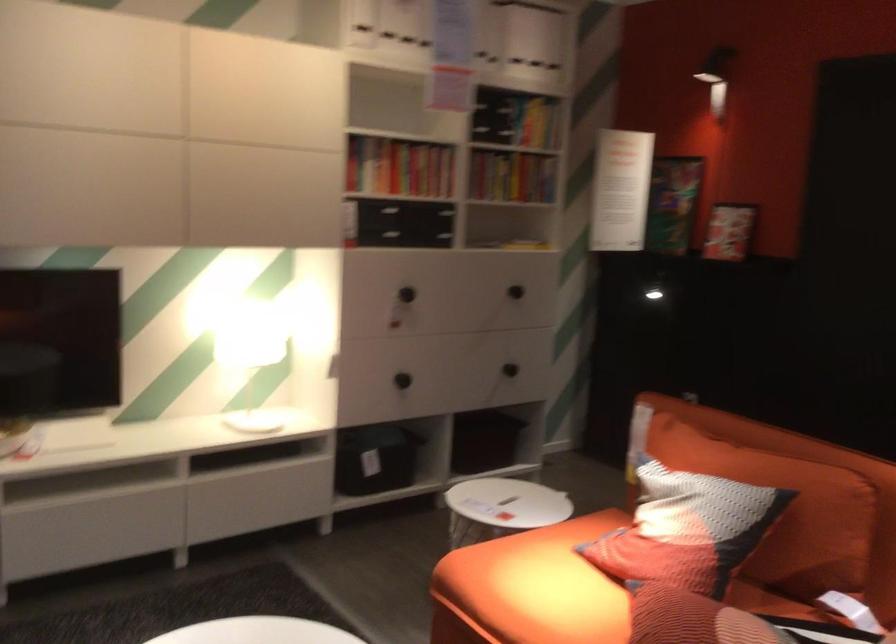
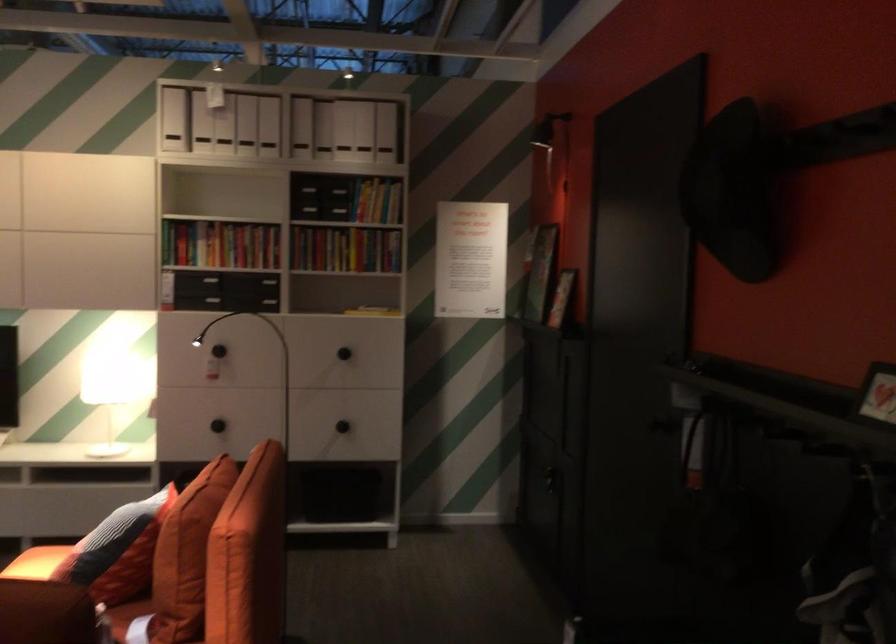
Where in the second image is the point corresponding to the point at 774,524 from the first image?

(117, 551)